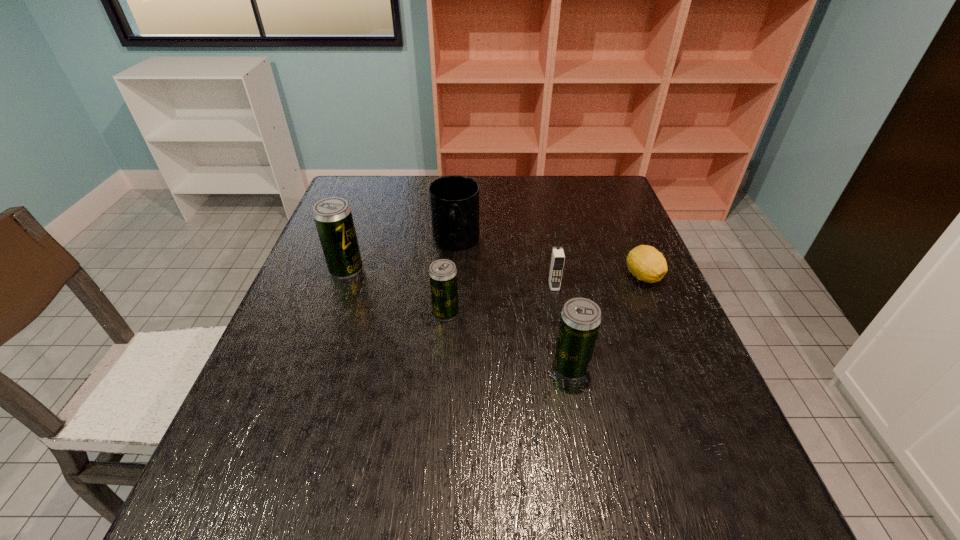
I want to click on the farthest beer can, so click(333, 218).

I want to click on the leftmost object, so click(x=333, y=218).

Where is `the second beer can from left to right`? the second beer can from left to right is located at coordinates (443, 281).

Identify the location of the second nearest beer can. This screenshot has width=960, height=540. (443, 281).

You are a GUI agent. You are given a task and a screenshot of the screen. Output one action in this format:
    pyautogui.click(x=<x>, y=<y>)
    Task: Click on the nearest beer can
    
    Given the screenshot: What is the action you would take?
    pyautogui.click(x=580, y=319)

Where is `the nearest object`? This screenshot has width=960, height=540. the nearest object is located at coordinates (580, 319).

Identify the location of cellular telephone. The width and height of the screenshot is (960, 540). (557, 257).

At what (x,y) coordinates should I click in order to perform the action: click on mug. Please return your answer as a coordinate pair (x, y). The height and width of the screenshot is (540, 960). Looking at the image, I should click on (454, 200).

This screenshot has width=960, height=540. Find the location of `the shortest object`. the shortest object is located at coordinates (x=646, y=263).

Image resolution: width=960 pixels, height=540 pixels. What are the coordinates of `the rightmost object` in the screenshot? It's located at (646, 263).